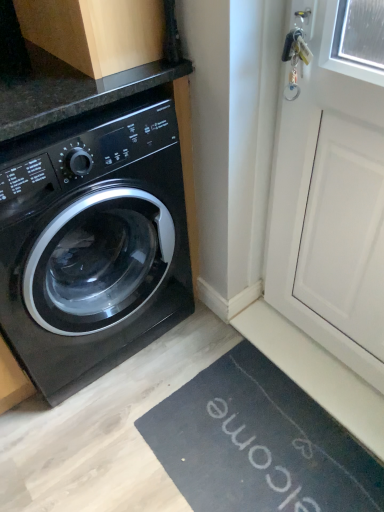
The image size is (384, 512). I want to click on free space in front of wooden cabinet at upper left, so click(x=79, y=84).